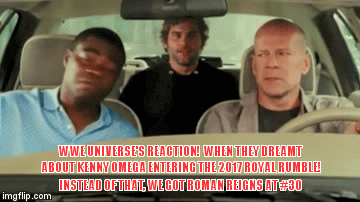
You are a GUI agent. You are given a task and a screenshot of the screen. Output one action in this format:
    pyautogui.click(x=<x>, y=<y>)
    Task: Click on the windows
    The height and width of the screenshot is (202, 360).
    Given the screenshot: What is the action you would take?
    pyautogui.click(x=347, y=52), pyautogui.click(x=235, y=32), pyautogui.click(x=5, y=42)